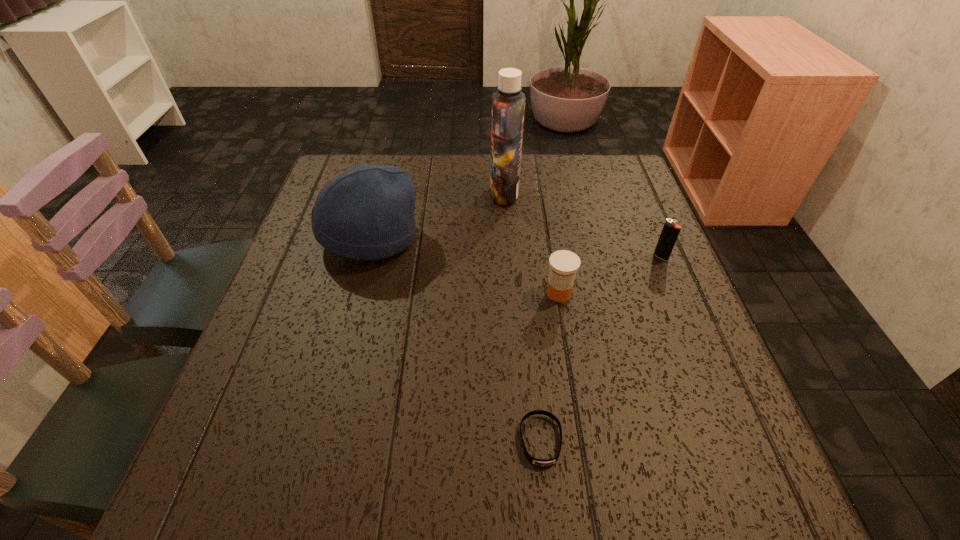
I want to click on vacant space at the left edge of the desktop, so click(293, 354).

Image resolution: width=960 pixels, height=540 pixels. In the image, there is a desktop. Find the location of `vacant space at the right edge`. vacant space at the right edge is located at coordinates (650, 230).

I want to click on free space at the far right corner of the desktop, so click(582, 178).

The image size is (960, 540). In order to click on vacant point located between the shortest object and the shampoo in this screenshot , I will do `click(522, 316)`.

What are the coordinates of `free area in between the rightmost object and the tallest object` in the screenshot? It's located at (583, 225).

This screenshot has width=960, height=540. What are the coordinates of `free spot between the rightmost object and the second tallest object` in the screenshot? It's located at point(516,247).

Locate an element on the screen. This screenshot has height=540, width=960. free spot between the leftmost object and the medicine is located at coordinates (465, 266).

Image resolution: width=960 pixels, height=540 pixels. I want to click on free space between the shampoo and the rightmost object, so click(x=583, y=225).

Locate an element on the screen. The width and height of the screenshot is (960, 540). free area in between the tallest object and the fourth shortest object is located at coordinates (437, 215).

Identify the location of vacant area that lies between the leftmost object and the igniter. (x=516, y=247).